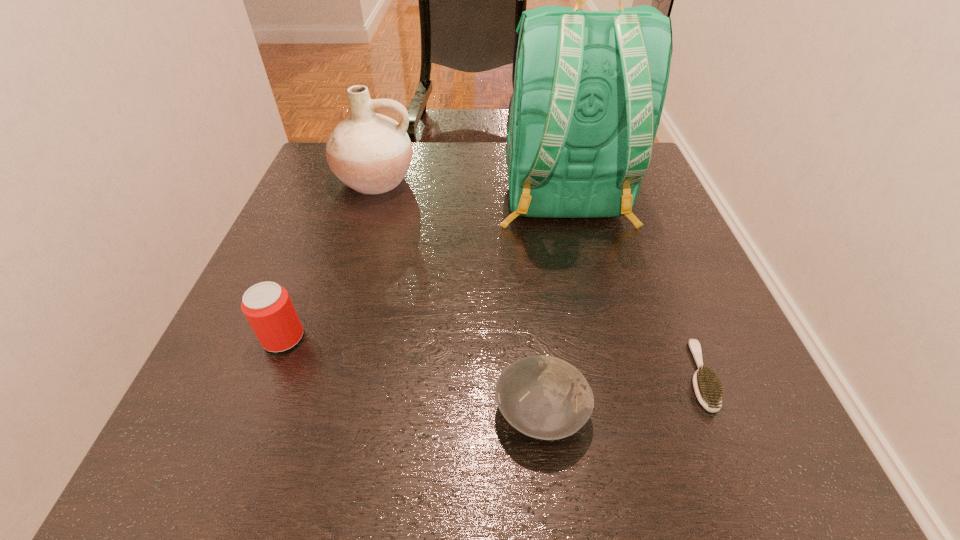
Find the location of `vacant space at the near edge`. vacant space at the near edge is located at coordinates (407, 443).

Image resolution: width=960 pixels, height=540 pixels. In the image, there is a desktop. In order to click on vacant space at the left edge in this screenshot , I will do `click(227, 373)`.

Locate an element on the screen. The image size is (960, 540). free space at the right edge of the desktop is located at coordinates (652, 203).

Locate an element on the screen. free space between the beer can and the bowl is located at coordinates (412, 374).

This screenshot has height=540, width=960. I want to click on free area in between the scrubbing brush and the second shortest object, so tap(620, 393).

Find the location of a particular element. This screenshot has width=960, height=540. empty location between the beer can and the second tallest object is located at coordinates (329, 259).

You are a GUI agent. You are given a task and a screenshot of the screen. Output one action in this format:
    pyautogui.click(x=<x>, y=<y>)
    Task: Click on the unoccupied position between the bowl and the pottery
    The image size is (960, 540).
    Given the screenshot: What is the action you would take?
    pyautogui.click(x=458, y=295)

You are a GUI agent. You are given a task and a screenshot of the screen. Output one action in this format:
    pyautogui.click(x=<x>, y=<y>)
    Task: Click on the unoccupied position between the second tallest object and the shortest object
    Image resolution: width=960 pixels, height=540 pixels.
    Given the screenshot: What is the action you would take?
    [x=537, y=278]

The image size is (960, 540). In order to click on free point between the bowl and the second tallest object in this screenshot , I will do `click(458, 295)`.

The image size is (960, 540). I want to click on free space between the fourth tallest object and the pottery, so click(458, 295).